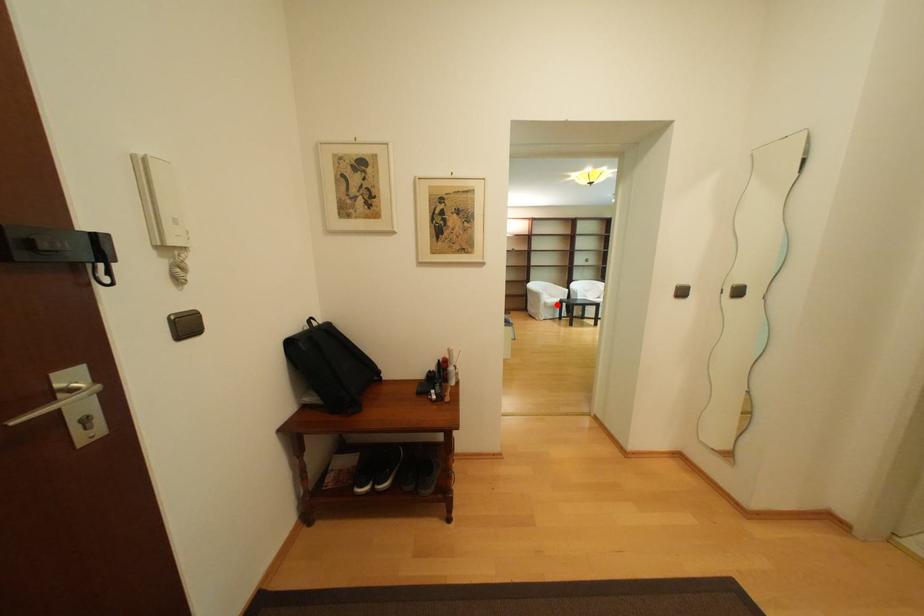
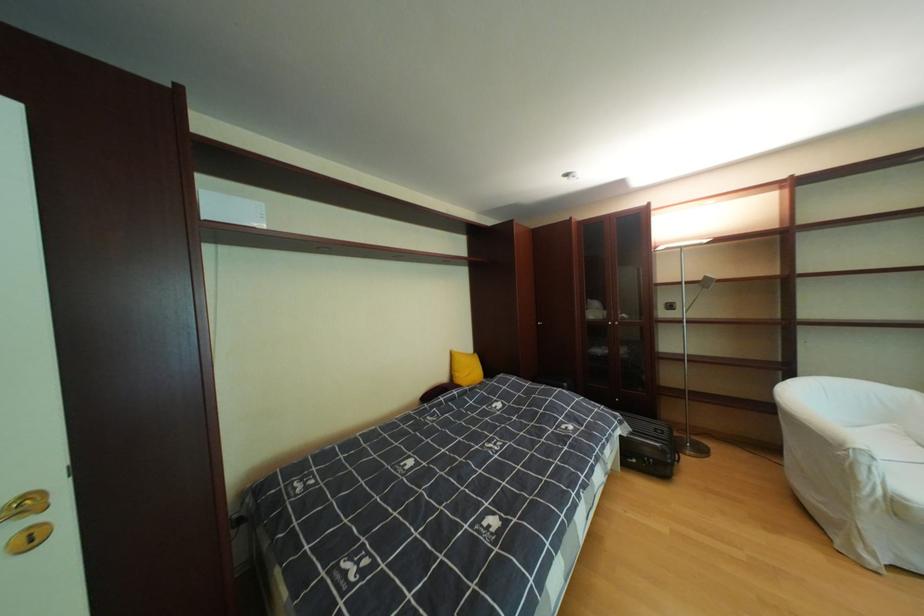
Locate, in the second image, the point that corresponds to the highlighted location in the first image.

(908, 506)